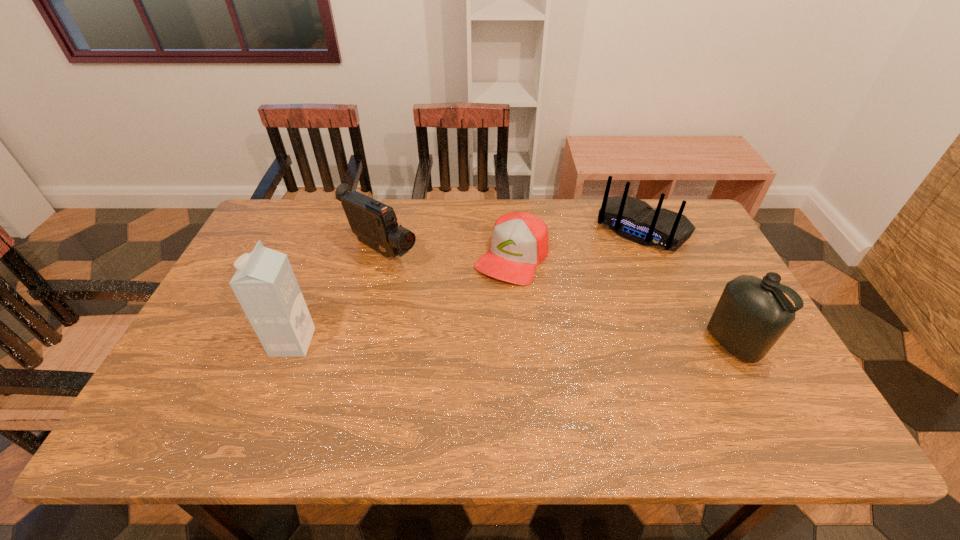
In the image, there is a desktop. At what (x,y) coordinates should I click in order to perform the action: click on vacant area at the near right corner. Please return your answer as a coordinate pair (x, y). Image resolution: width=960 pixels, height=540 pixels. Looking at the image, I should click on (784, 381).

You are a GUI agent. You are given a task and a screenshot of the screen. Output one action in this format:
    pyautogui.click(x=<x>, y=<y>)
    Task: Click on the unoccupied position between the third object from left to right and the carton
    Image resolution: width=960 pixels, height=540 pixels.
    Given the screenshot: What is the action you would take?
    pyautogui.click(x=402, y=299)

Locate an element on the screen. This screenshot has width=960, height=540. vacant area that lies between the router and the bottle is located at coordinates (687, 287).

Where is `free spot between the camcorder and the second tallest object`? free spot between the camcorder and the second tallest object is located at coordinates (557, 298).

Identify the location of unoccupied position between the tallest object and the camcorder. (337, 296).

You are a GUI agent. You are given a task and a screenshot of the screen. Output one action in this format:
    pyautogui.click(x=<x>, y=<y>)
    Task: Click on the free spot between the shortest object and the bottle
    
    Given the screenshot: What is the action you would take?
    pyautogui.click(x=622, y=300)

You are a GUI agent. You are given a task and a screenshot of the screen. Output one action in this format:
    pyautogui.click(x=<x>, y=<y>)
    Task: Click on the free space between the router and the fourth shortest object
    The width and height of the screenshot is (960, 540).
    Given the screenshot: What is the action you would take?
    pyautogui.click(x=687, y=287)

In order to click on vacant space in between the camcorder and the carton in this screenshot , I will do `click(337, 296)`.

Where is `vacant area that lies between the baseball cap and the fourth shortest object`? This screenshot has height=540, width=960. vacant area that lies between the baseball cap and the fourth shortest object is located at coordinates (622, 300).

Image resolution: width=960 pixels, height=540 pixels. I want to click on free spot between the bottle and the router, so click(687, 287).